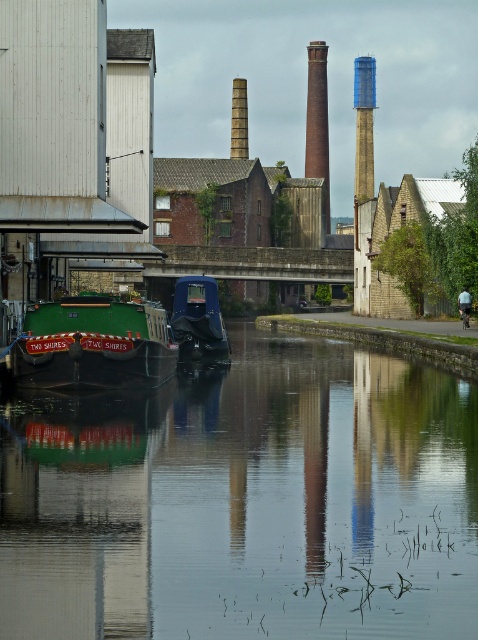
You are standing on the dock and see the green matte barge at center and the dark blue plastic boat at center. Which boat is closer to your left side?

The green matte barge at center is to the left of the dark blue plastic boat at center, so it is closer to your left side.

You are standing on the dock and want to know which object is taller between the green rubber boat at center and the smooth brick chimney at center. Can you determine this based on the scene?

The green rubber boat at center is not as tall as the smooth brick chimney at center, so the smooth brick chimney at center is taller.

You are standing at the point with coordinates point [85,614] and want to walk towards the point with coordinates point [239,80]. Based on the scene description, which direction should you face to move directly towards your destination?

You should face north because point [85,614] is in front of point [239,80], indicating that the destination is north of your current position.